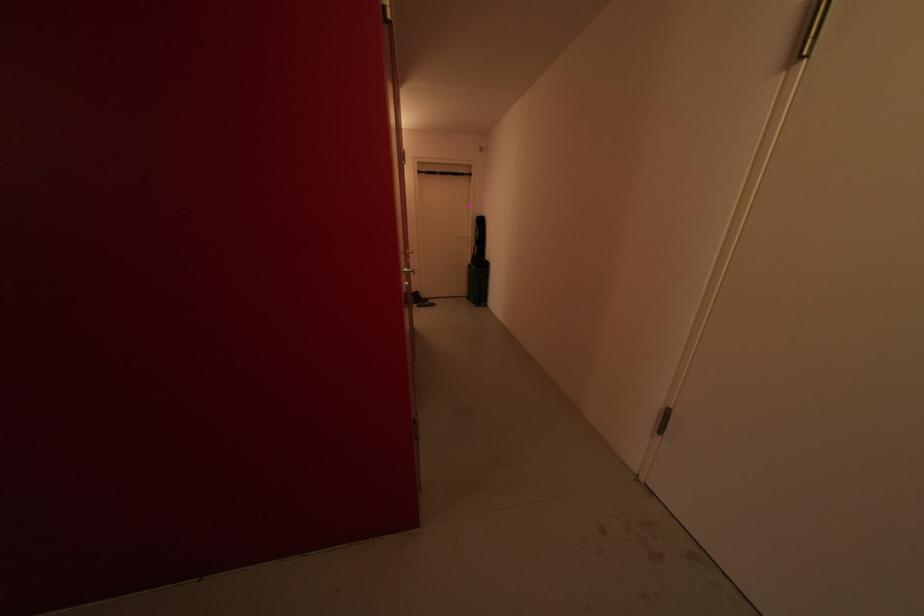
Image resolution: width=924 pixels, height=616 pixels. Describe the element at coordinates (407, 272) in the screenshot. I see `the metal door handle` at that location.